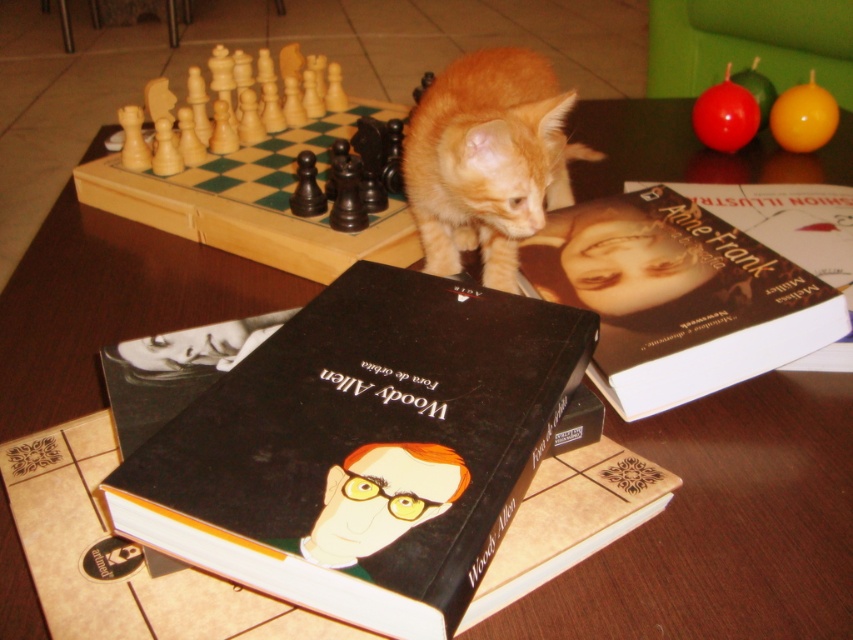
Question: Estimate the real-world distances between objects in this image. Which object is closer to the light wood chess set at upper left?

Choices:
 (A) hardcover book at upper right
 (B) orange fur cat at center

Answer: (B)

Question: Does hardcover book at upper right appear over orange fur cat at center?

Choices:
 (A) no
 (B) yes

Answer: (A)

Question: Which of these objects is positioned closest to the light wood chess set at upper left?

Choices:
 (A) hardcover book at upper right
 (B) black matte book at center

Answer: (A)

Question: Can you confirm if orange fur cat at center is positioned below light wood chess set at upper left?

Choices:
 (A) yes
 (B) no

Answer: (A)

Question: From the image, what is the correct spatial relationship of orange fur cat at center in relation to light wood chess set at upper left?

Choices:
 (A) right
 (B) left

Answer: (A)

Question: Which object is positioned closest to the orange fur cat at center?

Choices:
 (A) black matte book at center
 (B) light wood chess set at upper left

Answer: (B)